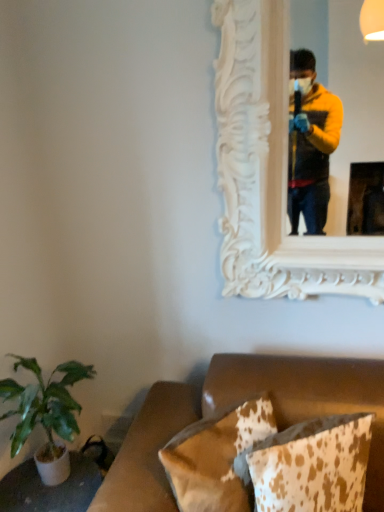
Question: From a real-world perspective, relative to green leafy plant at lower left, is white carved wood mirror at upper center vertically above or below?

Choices:
 (A) above
 (B) below

Answer: (A)

Question: Visually, is white carved wood mirror at upper center positioned to the left or to the right of green leafy plant at lower left?

Choices:
 (A) right
 (B) left

Answer: (A)

Question: Considering the real-world distances, which object is closest to the brown cowhide pillow at lower center, which ranks as the 1th pillow in left-to-right order?

Choices:
 (A) green leafy plant at lower left
 (B) cowhide pillow at lower right, which ranks as the second pillow in left-to-right order
 (C) white carved wood mirror at upper center

Answer: (B)

Question: Which of these objects is positioned farthest from the green leafy plant at lower left?

Choices:
 (A) brown cowhide pillow at lower center, which appears as the 2th pillow when viewed from the right
 (B) cowhide pillow at lower right, which ranks as the second pillow in left-to-right order
 (C) white carved wood mirror at upper center

Answer: (C)